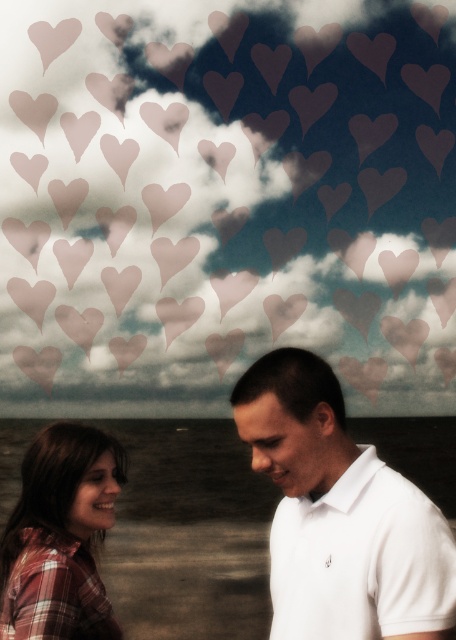
Is point (253, 429) more distant than point (93, 451)?

No, (253, 429) is closer to viewer.

Does white cotton polo shirt at center have a lesser width compared to plaid fabric shirt at lower left?

No, white cotton polo shirt at center is not thinner than plaid fabric shirt at lower left.

This screenshot has height=640, width=456. Describe the element at coordinates (340, 515) in the screenshot. I see `white cotton polo shirt at center` at that location.

Locate an element on the screen. This screenshot has height=640, width=456. white cotton polo shirt at center is located at coordinates (340, 515).